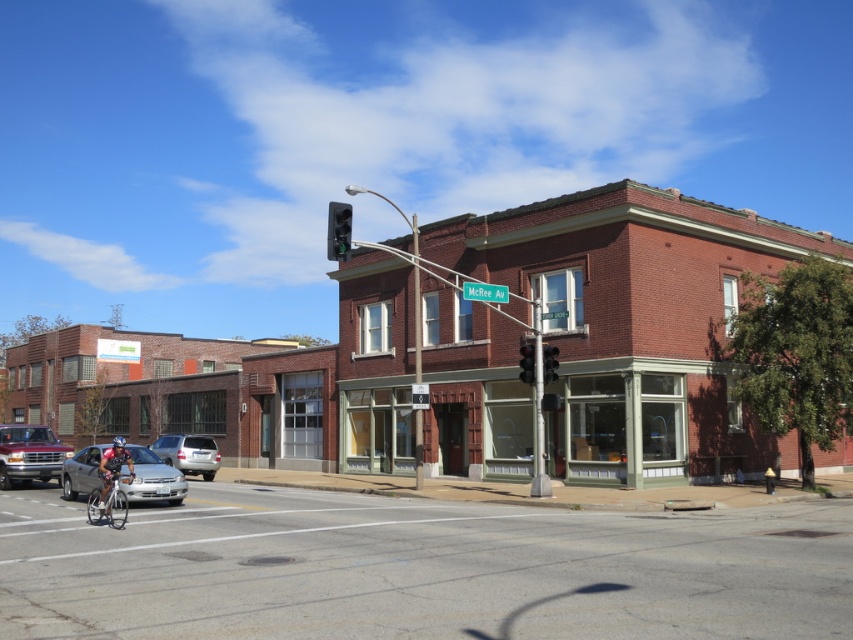
Can you confirm if metallic bicycle at lower left is taller than black glass traffic light at upper center?

No, metallic bicycle at lower left is not taller than black glass traffic light at upper center.

Is point (38, 552) positioned in front of point (346, 228)?

That is True.

What are the coordinates of `metallic bicycle at lower left` in the screenshot? It's located at (419, 570).

Is matte silver truck at lower left taller than silver metallic bicycle at lower left?

In fact, matte silver truck at lower left may be shorter than silver metallic bicycle at lower left.

Which of these two, matte silver truck at lower left or silver metallic bicycle at lower left, stands shorter?

Standing shorter between the two is matte silver truck at lower left.

Who is more forward, [67,451] or [109,506]?

Point [109,506] is more forward.

Identify the location of matte silver truck at lower left. The image size is (853, 640). (28, 454).

Is satin silver sedan at center shorter than silver metallic bicycle at lower left?

Yes, satin silver sedan at center is shorter than silver metallic bicycle at lower left.

Is satin silver sedan at center taller than silver metallic bicycle at lower left?

Incorrect, satin silver sedan at center's height is not larger of silver metallic bicycle at lower left's.

I want to click on satin silver sedan at center, so click(x=189, y=452).